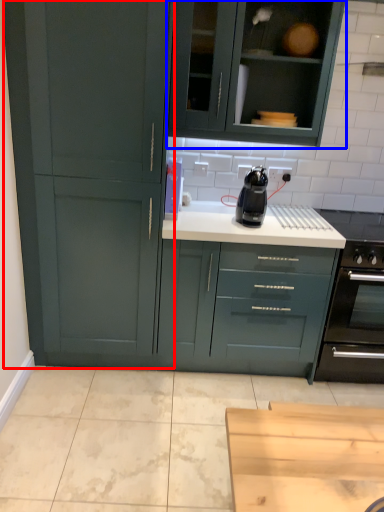
Question: Among these objects, which one is farthest to the camera, cupboard (highlighted by a red box) or cabinetry (highlighted by a blue box)?

Choices:
 (A) cupboard
 (B) cabinetry

Answer: (B)